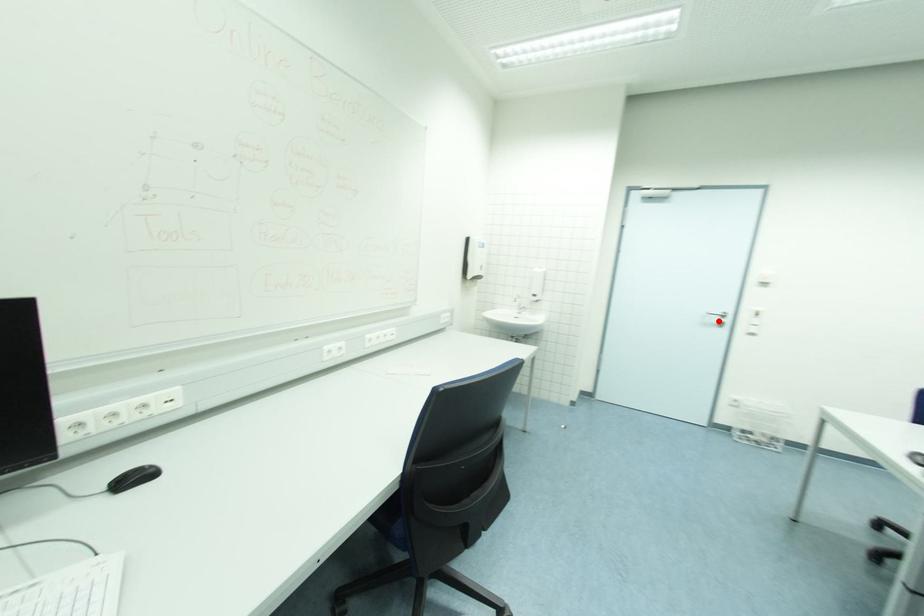
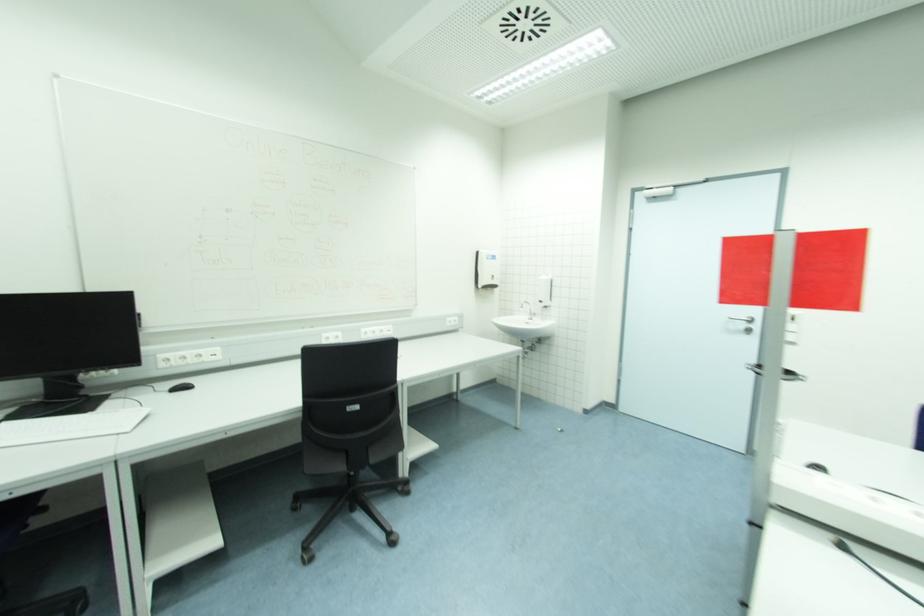
In the second image, find the point that corresponds to the highlighted location in the first image.

(746, 326)